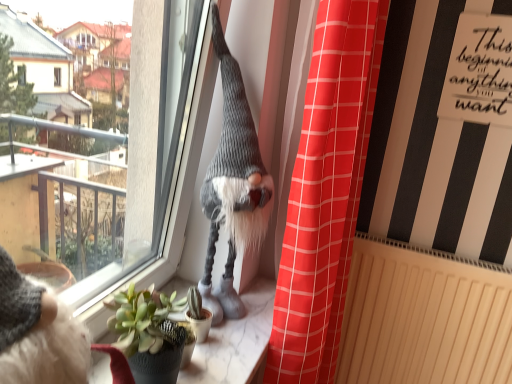
The height and width of the screenshot is (384, 512). Describe the element at coordinates (326, 192) in the screenshot. I see `red plaid curtain at center` at that location.

The height and width of the screenshot is (384, 512). What do you see at coordinates (236, 342) in the screenshot?
I see `marble at center` at bounding box center [236, 342].

The height and width of the screenshot is (384, 512). I want to click on beige textured radiator at lower right, so click(424, 317).

Identify the location of white paper at upper right. The image size is (512, 384). (x=480, y=71).

From a real-world perspective, is transparent glass window at upper center positioned over white paper at upper right based on gravity?

No, from a real-world perspective, transparent glass window at upper center is not on top of white paper at upper right.

Looking at this image, is transparent glass window at upper center in front of white paper at upper right?

Yes, it is in front of white paper at upper right.

Based on their sizes in the image, would you say transparent glass window at upper center is bigger or smaller than white paper at upper right?

Clearly, transparent glass window at upper center is larger in size than white paper at upper right.

From the picture: Is transparent glass window at upper center to the right of white paper at upper right from the viewer's perspective?

No, transparent glass window at upper center is not to the right of white paper at upper right.

Considering the sizes of transparent glass window at upper center and green succulent at lower left in the image, is transparent glass window at upper center bigger or smaller than green succulent at lower left?

In the image, transparent glass window at upper center appears to be larger than green succulent at lower left.

Consider the image. Which is correct: transparent glass window at upper center is inside green succulent at lower left, or outside of it?

transparent glass window at upper center is not inside green succulent at lower left, it's outside.

Find the location of a particular element. houseplant below the transparent glass window at upper center (from a real-world perspective) is located at coordinates (148, 334).

How far apart are beige textured radiator at lower right and red plaid curtain at center?

15.51 inches.

Between beige textured radiator at lower right and red plaid curtain at center, which one is positioned behind?

beige textured radiator at lower right.

Considering the relative sizes of beige textured radiator at lower right and red plaid curtain at center in the image provided, is beige textured radiator at lower right thinner than red plaid curtain at center?

Indeed, beige textured radiator at lower right has a lesser width compared to red plaid curtain at center.

Is beige textured radiator at lower right smaller than red plaid curtain at center?

Indeed, beige textured radiator at lower right has a smaller size compared to red plaid curtain at center.

Which of these two, red plaid curtain at center or marble at center, stands shorter?

With less height is marble at center.

This screenshot has width=512, height=384. I want to click on curtain on the right of marble at center, so click(x=326, y=192).

Which is in front, point (309, 259) or point (186, 285)?

Positioned in front is point (309, 259).

Between red plaid curtain at center and marble at center, which one has larger size?

red plaid curtain at center.

Which is behind, point (245, 195) or point (160, 325)?

The point (245, 195) is farther from the camera.

Would you say knitted gray gnome at center contains green succulent at lower left?

No, green succulent at lower left is not a part of knitted gray gnome at center.

From the image's perspective, relative to green succulent at lower left, is knitted gray gnome at center above or below?

From the image's perspective, knitted gray gnome at center appears above green succulent at lower left.

Identify the location of window sill in front of the knitted gray gnome at center. Image resolution: width=512 pixels, height=384 pixels. (236, 342).

From a real-world perspective, which object stands above the other?

In real-world perspective, knitted gray gnome at center is above.

Is marble at center far away from knitted gray gnome at center?

No, there isn't a large distance between marble at center and knitted gray gnome at center.

Is marble at center shorter than white paper at upper right?

Indeed, marble at center has a lesser height compared to white paper at upper right.

From a real-world perspective, is marble at center above or below white paper at upper right?

marble at center is below white paper at upper right.

Is marble at center directly adjacent to white paper at upper right?

There is a gap between marble at center and white paper at upper right.

Locate an element on the screen. window that is in front of the white paper at upper right is located at coordinates (108, 161).

Identify the location of houseplant below the transparent glass window at upper center (from a real-world perspective). (148, 334).

Considering their positions, is transparent glass window at upper center positioned closer to green succulent at lower left than knitted gray gnome at center?

Based on the image, knitted gray gnome at center appears to be nearer to green succulent at lower left.

Looking at the image, which one is located closer to transparent glass window at upper center, red plaid curtain at center or white paper at upper right?

The object closer to transparent glass window at upper center is red plaid curtain at center.

Based on the photo, estimate the real-world distances between objects in this image. Which object is further from knitted gray gnome at center, transparent glass window at upper center or red plaid curtain at center?

transparent glass window at upper center is positioned further to the anchor knitted gray gnome at center.

Looking at the image, which one is located closer to transparent glass window at upper center, knitted gray gnome at center or white paper at upper right?

Among the two, knitted gray gnome at center is located nearer to transparent glass window at upper center.

Considering their positions, is marble at center positioned further to beige textured radiator at lower right than white paper at upper right?

Among the two, white paper at upper right is located further to beige textured radiator at lower right.

From the picture: Considering their positions, is white paper at upper right positioned further to green succulent at lower left than transparent glass window at upper center?

white paper at upper right lies further to green succulent at lower left than the other object.

Looking at this image, which object lies further to the anchor point knitted gray gnome at center, white paper at upper right or beige textured radiator at lower right?

The object further to knitted gray gnome at center is white paper at upper right.

Looking at the image, which one is located closer to beige textured radiator at lower right, transparent glass window at upper center or marble at center?

marble at center is closer to beige textured radiator at lower right.

Identify the location of window sill between transparent glass window at upper center and beige textured radiator at lower right. Image resolution: width=512 pixels, height=384 pixels. (236, 342).

In order to click on curtain between marble at center and white paper at upper right from left to right in this screenshot , I will do `click(326, 192)`.

Where is `houseplant located between transparent glass window at upper center and red plaid curtain at center in the left-right direction`? This screenshot has width=512, height=384. houseplant located between transparent glass window at upper center and red plaid curtain at center in the left-right direction is located at coordinates (148, 334).

Image resolution: width=512 pixels, height=384 pixels. In order to click on curtain that lies between white paper at upper right and beige textured radiator at lower right from top to bottom in this screenshot , I will do `click(326, 192)`.